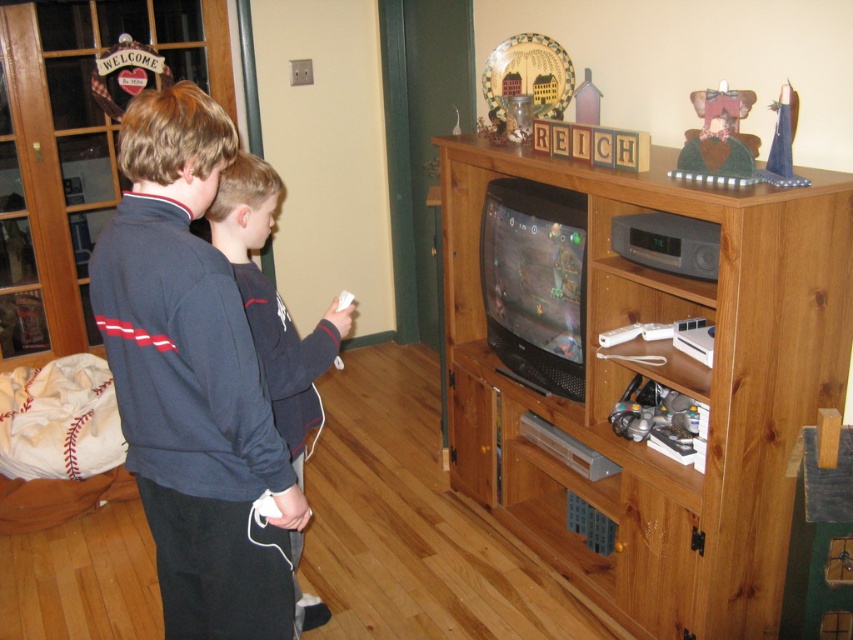
Based on the photo, you are standing at the camera position and want to place a 1.5 meters long ladder between you and the point at point (231, 292). Will the ladder reach that point?

The distance between you and the point (231, 292) is 1.46 meters. Since the ladder is 1.5 meters long, it will just barely reach the point.

You are trying to reach the white matte remote at center to change the TV channel. However, the brown wood entertainment center at center is blocking your path. Can you move the entertainment center to access the remote?

The brown wood entertainment center at center is in front of the white matte remote at center, so moving it would allow you to access the remote.

You are in the living room and want to place a small decoration between the two points labeled point (846, 173) and point (346, 296). Which point should the decoration be closer to in order to be nearer to the viewer?

The decoration should be placed closer to point (846, 173) because it is closer to the viewer than point (346, 296).